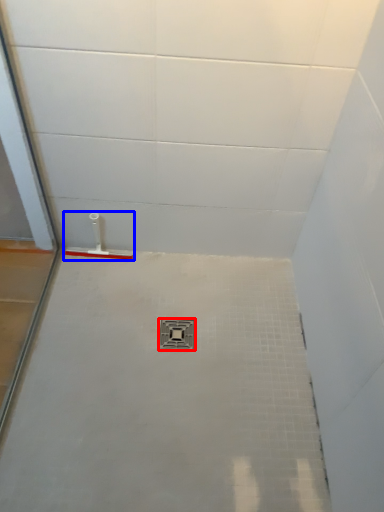
Question: Among these objects, which one is farthest to the camera, plumbing fixture (highlighted by a red box) or shower (highlighted by a blue box)?

Choices:
 (A) plumbing fixture
 (B) shower

Answer: (B)